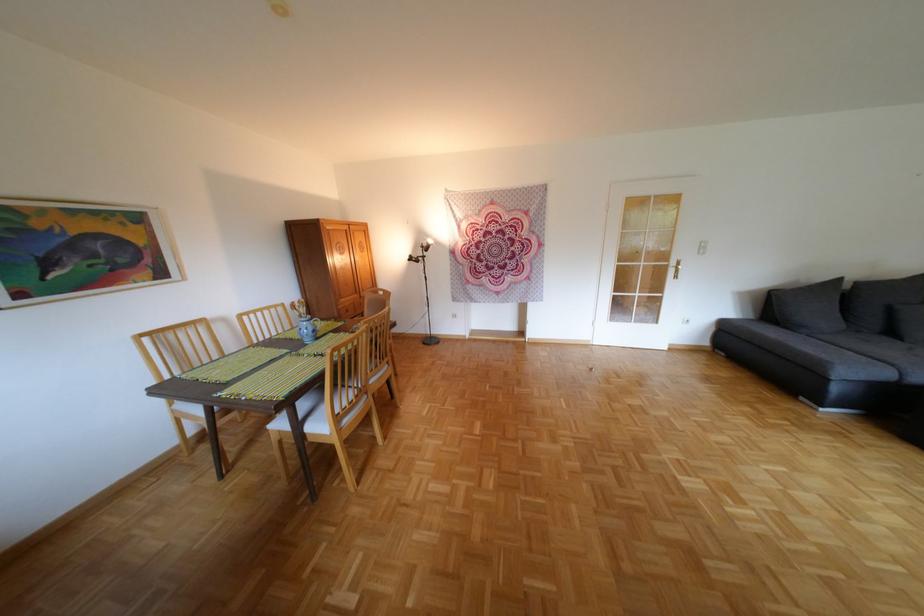
Where would you sit the sofa sitting surface? Please return your answer as a coordinate pair (x, y).

(878, 349)